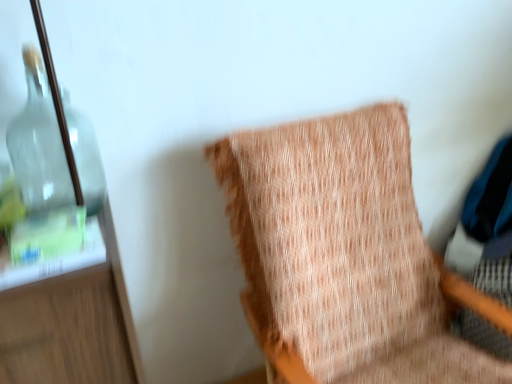
Find the location of `textured peach fabric at center`. textured peach fabric at center is located at coordinates (342, 252).

Measure the distance between textured peach fabric at center and camera.

textured peach fabric at center is 3.33 feet away from camera.

The width and height of the screenshot is (512, 384). Describe the element at coordinates (342, 252) in the screenshot. I see `textured peach fabric at center` at that location.

Describe the element at coordinates (38, 143) in the screenshot. I see `transparent glass bottle at left` at that location.

Find the location of a particular element. transparent glass bottle at left is located at coordinates (38, 143).

The height and width of the screenshot is (384, 512). Find the location of `textured peach fabric at center`. textured peach fabric at center is located at coordinates [x=342, y=252].

Which object is positioned more to the right, textured peach fabric at center or transparent glass bottle at left?

textured peach fabric at center.

Is the position of textured peach fabric at center more distant than that of transparent glass bottle at left?

No, textured peach fabric at center is closer to the viewer.

Between point (402, 329) and point (101, 205), which one is positioned behind?

Point (402, 329)

From the image's perspective, is textured peach fabric at center over transparent glass bottle at left?

Incorrect, from the image's perspective, textured peach fabric at center is lower than transparent glass bottle at left.

From a real-world perspective, who is located higher, textured peach fabric at center or transparent glass bottle at left?

transparent glass bottle at left, from a real-world perspective.

From the picture: Can you confirm if textured peach fabric at center is thinner than transparent glass bottle at left?

Incorrect, the width of textured peach fabric at center is not less than that of transparent glass bottle at left.

Which of these two, textured peach fabric at center or transparent glass bottle at left, stands shorter?

transparent glass bottle at left.

Who is smaller, textured peach fabric at center or transparent glass bottle at left?

transparent glass bottle at left.

From the picture: Is textured peach fabric at center outside of transparent glass bottle at left?

That's correct, textured peach fabric at center is outside of transparent glass bottle at left.

Can you see textured peach fabric at center touching transparent glass bottle at left?

There is a gap between textured peach fabric at center and transparent glass bottle at left.

Is textured peach fabric at center facing towards transparent glass bottle at left?

No, textured peach fabric at center is not aimed at transparent glass bottle at left.

This screenshot has width=512, height=384. Find the location of `chair located in front of the transparent glass bottle at left`. chair located in front of the transparent glass bottle at left is located at coordinates (342, 252).

Is transparent glass bottle at left to the right of textured peach fabric at center from the viewer's perspective?

In fact, transparent glass bottle at left is to the left of textured peach fabric at center.

Is transparent glass bottle at left closer to the viewer compared to textured peach fabric at center?

That is False.

Is point (27, 122) less distant than point (219, 147)?

Yes, it is.

From the image's perspective, is transparent glass bottle at left below textured peach fabric at center?

Incorrect, from the image's perspective, transparent glass bottle at left is higher than textured peach fabric at center.

From a real-world perspective, who is located lower, transparent glass bottle at left or textured peach fabric at center?

textured peach fabric at center is physically lower.

Considering the relative sizes of transparent glass bottle at left and textured peach fabric at center in the image provided, is transparent glass bottle at left wider than textured peach fabric at center?

In fact, transparent glass bottle at left might be narrower than textured peach fabric at center.

Looking at this image, can you confirm if transparent glass bottle at left is taller than textured peach fabric at center?

No, transparent glass bottle at left is not taller than textured peach fabric at center.

Does transparent glass bottle at left have a smaller size compared to textured peach fabric at center?

Indeed, transparent glass bottle at left has a smaller size compared to textured peach fabric at center.

Do you think transparent glass bottle at left is within textured peach fabric at center, or outside of it?

transparent glass bottle at left is outside textured peach fabric at center.

Is transparent glass bottle at left placed right next to textured peach fabric at center?

→ No.

Is transparent glass bottle at left oriented towards textured peach fabric at center?

No.

Consider the image. Can you tell me how much transparent glass bottle at left and textured peach fabric at center differ in facing direction?

The angular difference between transparent glass bottle at left and textured peach fabric at center is 5.49 degrees.

How much distance is there between transparent glass bottle at left and textured peach fabric at center?

transparent glass bottle at left and textured peach fabric at center are 23.12 inches apart.

Locate an element on the screen. This screenshot has width=512, height=384. chair that appears below the transparent glass bottle at left (from a real-world perspective) is located at coordinates (342, 252).

The image size is (512, 384). I want to click on chair that is under the transparent glass bottle at left (from a real-world perspective), so click(342, 252).

At what (x,y) coordinates should I click in order to perform the action: click on bottle on the left of textured peach fabric at center. Please return your answer as a coordinate pair (x, y). This screenshot has height=384, width=512. Looking at the image, I should click on (38, 143).